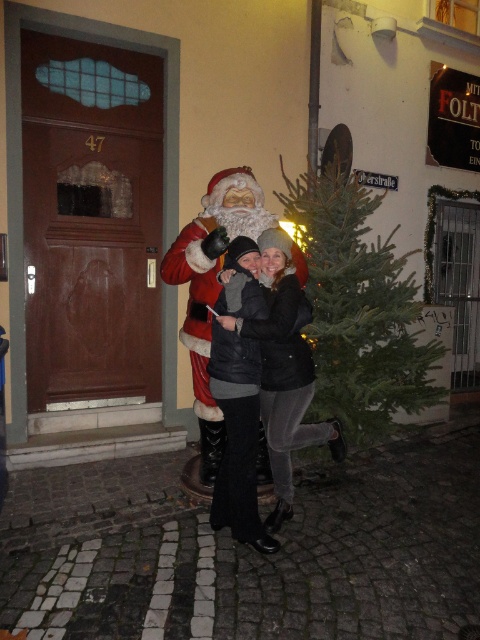
You are taking a photo of the black leather jacket at center and the red plush santa at center. Which one is to the left of the other?

The red plush santa at center is to the left of the black leather jacket at center because the black leather jacket at center is positioned on the right side of red plush santa at center.

You are taking a photo of the scene and want to ensure both the black leather jacket at center and the red plush santa at center are clearly visible. Based on their positions, which one should you focus on first to ensure proper framing?

The black leather jacket at center is located below the red plush santa at center, so you should focus on the red plush santa at center first to ensure both are in frame.